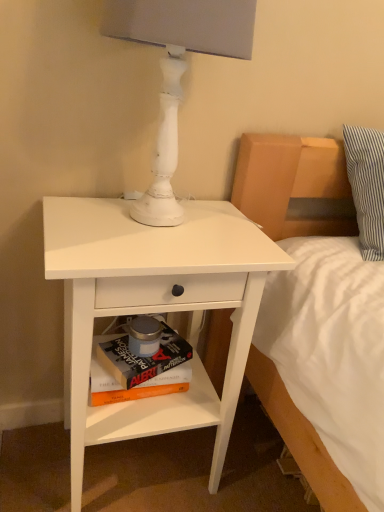
Identify the location of vacant space to the right of white painted wood table lamp at upper center. The width and height of the screenshot is (384, 512). click(x=240, y=234).